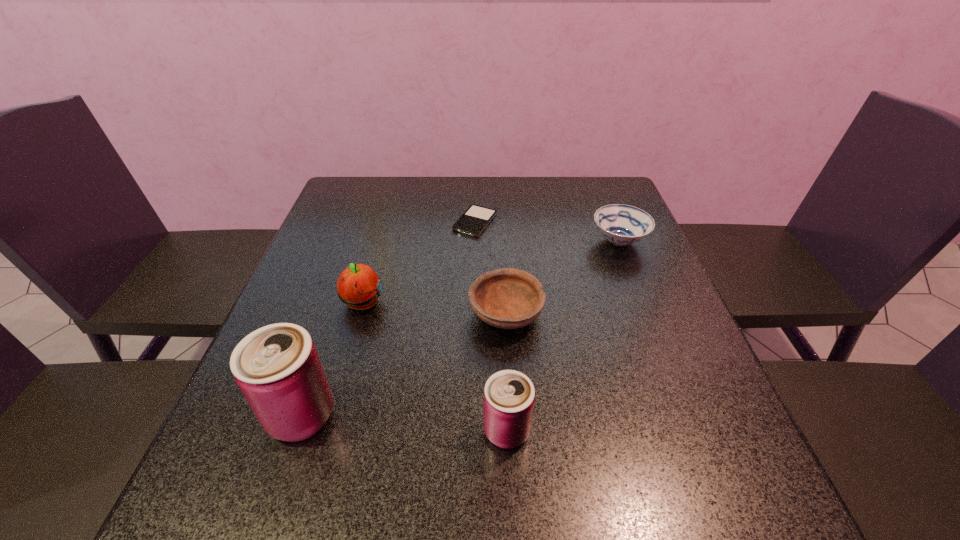
You are a GUI agent. You are given a task and a screenshot of the screen. Output one action in this format:
    pyautogui.click(x=<x>, y=<y>)
    Task: Click on the vacant space at the right edge of the desktop
    This screenshot has width=960, height=540.
    Given the screenshot: What is the action you would take?
    pyautogui.click(x=584, y=221)

Image resolution: width=960 pixels, height=540 pixels. In the image, there is a desktop. Identify the location of vacant region at the far right corner. (586, 179).

Locate an element on the screen. Image resolution: width=960 pixels, height=540 pixels. empty space between the tallest object and the shorter can is located at coordinates (404, 423).

Locate an element on the screen. The height and width of the screenshot is (540, 960). vacant area that lies between the iPod and the soup bowl is located at coordinates (547, 232).

Locate an element on the screen. The image size is (960, 540). free space between the apple and the bowl is located at coordinates (434, 309).

At what (x,y) coordinates should I click in order to perform the action: click on vacant area that lies between the rightmost object and the tallest object. Please return your answer as a coordinate pair (x, y). Looking at the image, I should click on (460, 328).

At what (x,y) coordinates should I click in order to perform the action: click on empty space that is in between the bowl and the iPod. Please return your answer as a coordinate pair (x, y). This screenshot has width=960, height=540. Looking at the image, I should click on (491, 268).

Identify the location of free space between the shorter can and the iPod. (491, 326).

The image size is (960, 540). I want to click on free space between the tallest object and the iPod, so click(388, 319).

At what (x,y) coordinates should I click in order to perform the action: click on blank region between the shorter can and the soup bowl. Please return your answer as a coordinate pair (x, y). The width and height of the screenshot is (960, 540). Looking at the image, I should click on (563, 336).